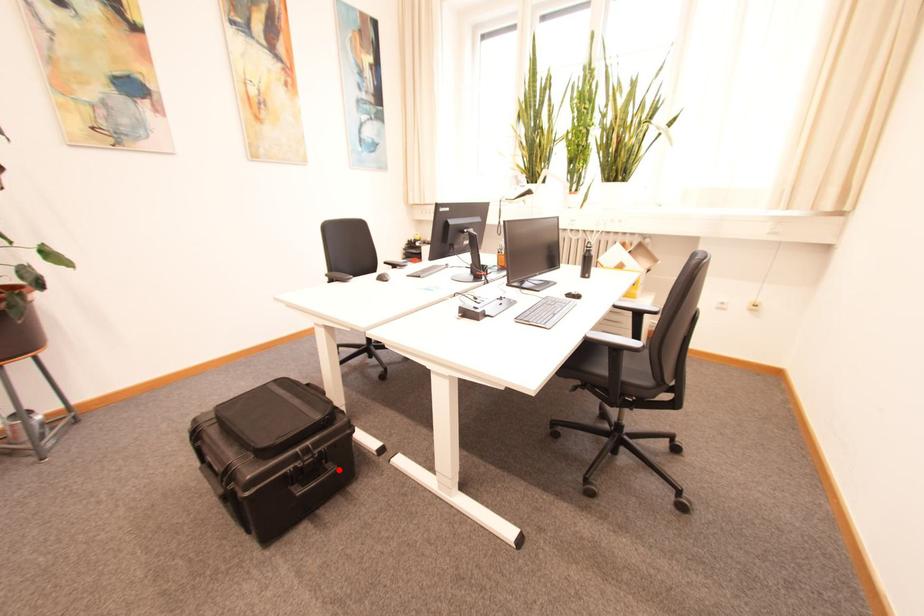
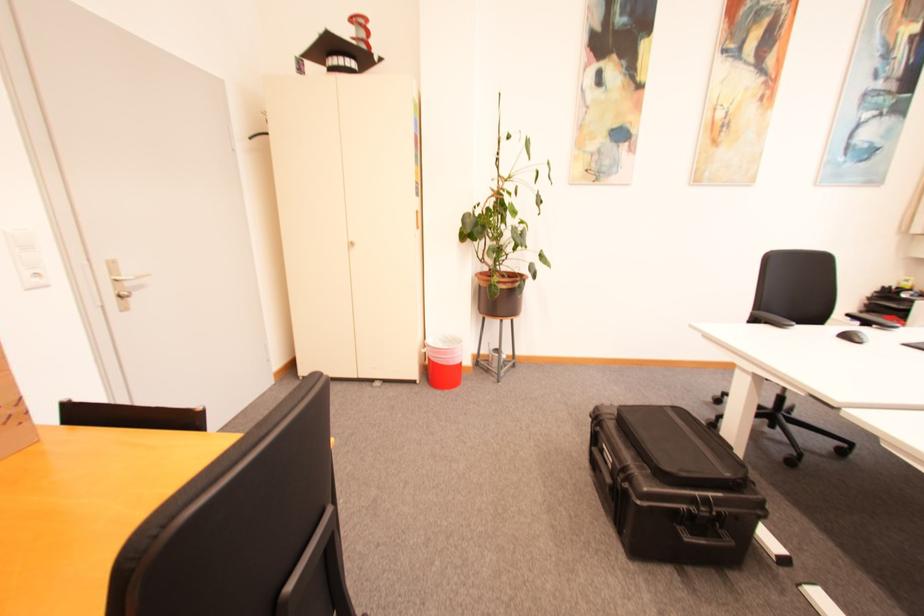
Question: I am providing you with two images of the same scene from different viewpoints. Given a red point in image1, look at the same physical point in image2. Is it:

Choices:
 (A) Closer to the viewpoint
 (B) Farther from the viewpoint

Answer: (A)